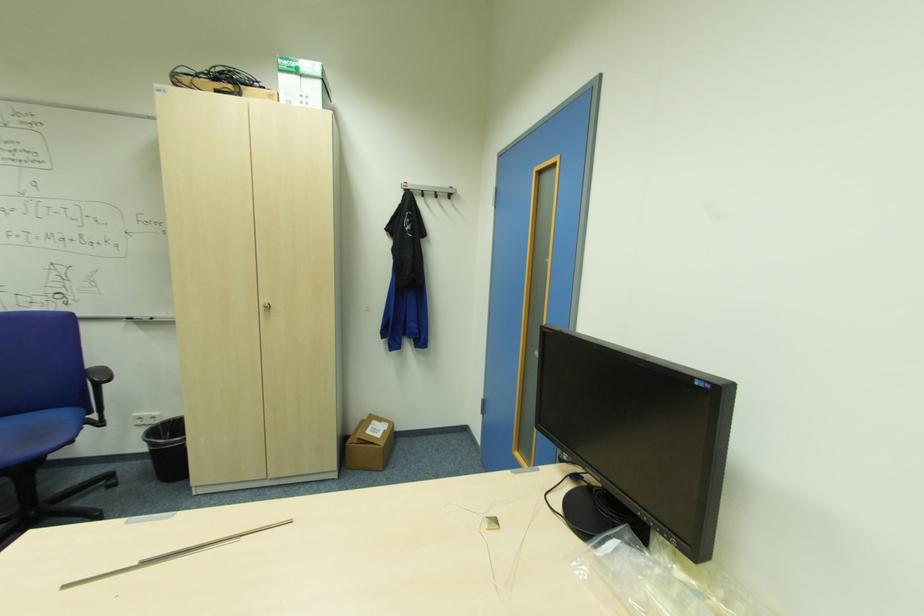
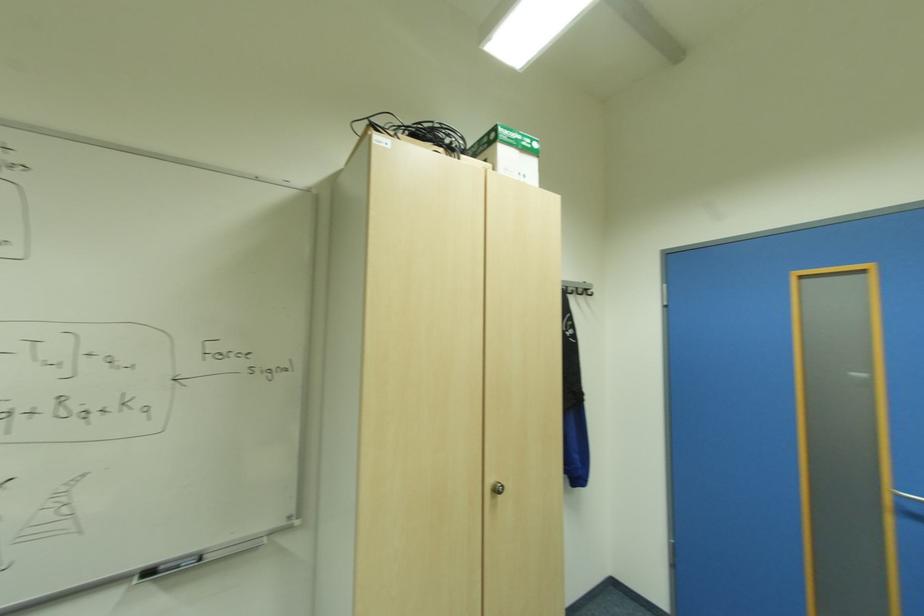
What movement of the cameraman would produce the second image?

The cameraman moved toward left, forward.